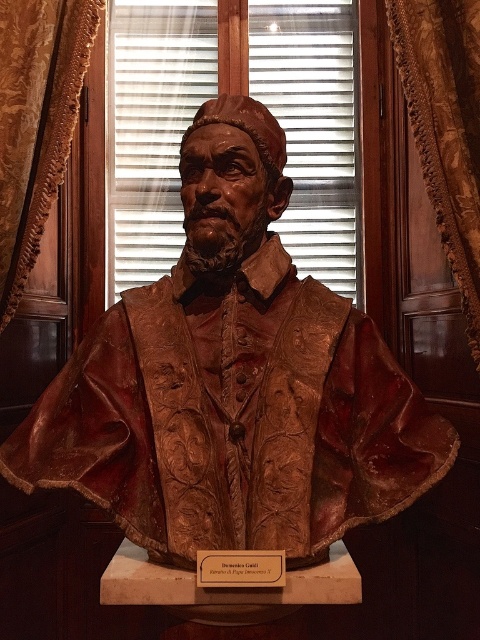
You are standing in front of the wooden bust sculpture and want to know which of the two points, point (x=313, y=97) or point (x=442, y=8), is closer to you. Which one is closer?

Point (x=313, y=97) is further to the camera than point (x=442, y=8), so the point closer to you is point (x=442, y=8).

You are a painter who wants to hang a 18 inch wide canvas between the white blinds at center and the velvet drapery at right. Is there enough space?

The white blinds at center and velvet drapery at right are 22.57 inches apart, so yes, the 18 inch wide canvas will fit between them since the space is wider than the canvas.

You are an interior designer assessing the space in the image. The bronze statue at center and the brown textured curtain at left are both in the room. Which object is wider?

The bronze statue at center is wider than the brown textured curtain at left.